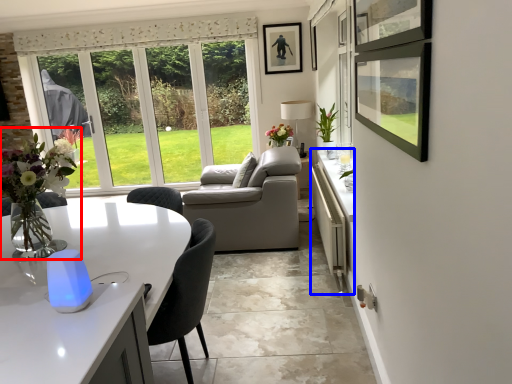
Question: Which object appears farthest to the camera in this image, floral arrangement (highlighted by a red box) or counter (highlighted by a blue box)?

Choices:
 (A) floral arrangement
 (B) counter

Answer: (B)